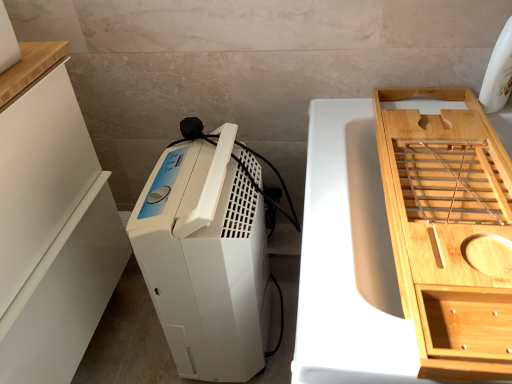
You are a GUI agent. You are given a task and a screenshot of the screen. Output one action in this format:
    pyautogui.click(x=<x>, y=<y>)
    Task: Click on the empty space that is ontop of bamboo tray at right (from a real-world perspective)
    The image size is (512, 384).
    Given the screenshot: What is the action you would take?
    pyautogui.click(x=433, y=191)